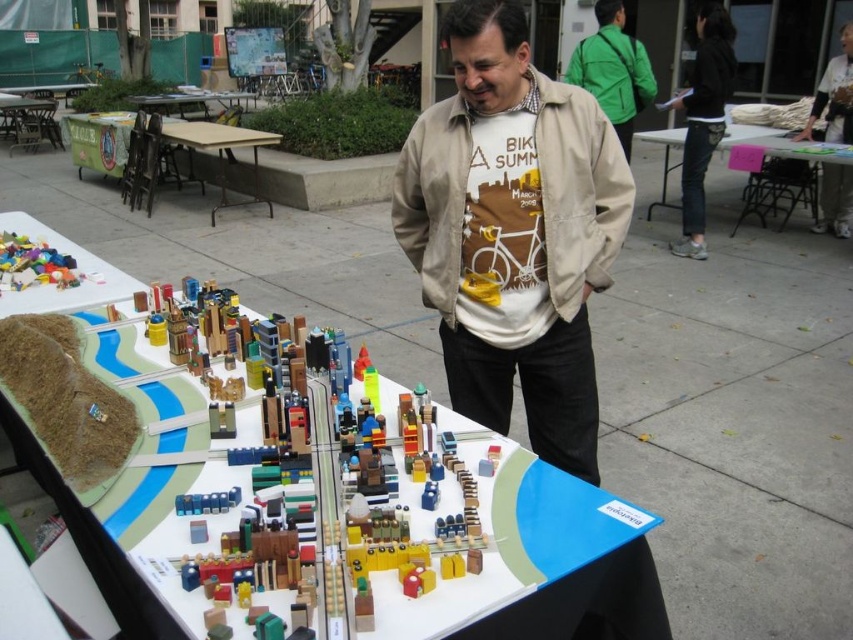
What do you see at coordinates (786, 150) in the screenshot?
I see `pink paper at upper right` at bounding box center [786, 150].

Is point (848, 209) positioned behind point (664, 157)?

No.

Measure the distance between point [844,208] and camera.

Point [844,208] is 6.65 meters away from camera.

Image resolution: width=853 pixels, height=640 pixels. What are the coordinates of `pink paper at upper right` in the screenshot? It's located at (786, 150).

Which is behind, point (526, 161) or point (9, 100)?

The point (9, 100) is more distant.

Is point (439, 148) farther from camera compared to point (59, 138)?

No.

Find the location of a particular element. beige cotton jacket at center is located at coordinates (514, 230).

At what (x,y) coordinates should I click in order to perform the action: click on beige cotton jacket at center. Please return your answer as a coordinate pair (x, y). The height and width of the screenshot is (640, 853). Looking at the image, I should click on (514, 230).

Is plastic toy blocks at center positioned before wooden table at left?

Yes, plastic toy blocks at center is closer to the viewer.

Who is more distant from viewer, (22, 292) or (50, 124)?

Point (50, 124)

Between point (97, 276) and point (36, 125), which one is positioned behind?

Point (36, 125)

Where is `plastic toy blocks at center`? The image size is (853, 640). plastic toy blocks at center is located at coordinates (67, 288).